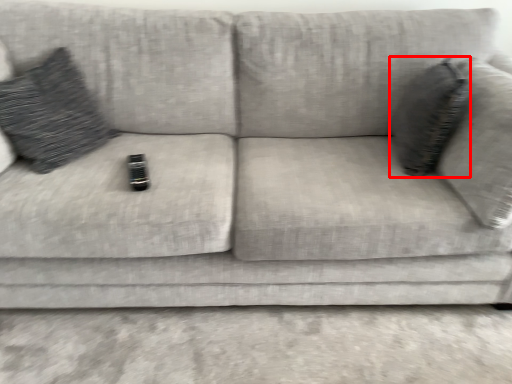
Question: From the image's perspective, what is the correct spatial positioning of throw pillow (annotated by the red box) in reference to throw pillow?

Choices:
 (A) below
 (B) above

Answer: (A)